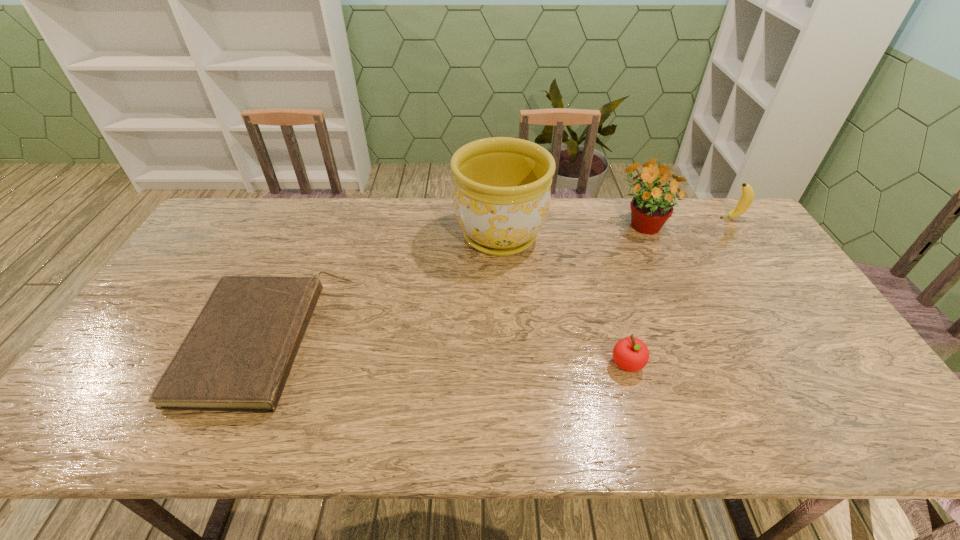
In order to click on free point between the leftmost object and the fourth object from left to right in this screenshot , I will do `click(455, 283)`.

The image size is (960, 540). What are the coordinates of `unoccupied position between the third object from left to right and the banana` in the screenshot? It's located at (679, 291).

This screenshot has height=540, width=960. I want to click on free space between the apple and the banana, so click(679, 291).

The width and height of the screenshot is (960, 540). What are the coordinates of `empty location between the apple and the right flowerpot` in the screenshot? It's located at (635, 294).

Image resolution: width=960 pixels, height=540 pixels. I want to click on free space between the apple and the shortest object, so click(447, 353).

The height and width of the screenshot is (540, 960). Find the location of `blank region between the rightmost object and the fourth object from right to left`. blank region between the rightmost object and the fourth object from right to left is located at coordinates (615, 227).

Identify which object is located as the fourth nearest to the banana. Please provide its 2D coordinates. Your answer should be formatted as a tuple, i.e. [(x, y)], where the tuple contains the x and y coordinates of a point satisfying the conditions above.

[(237, 356)]

Locate which object ranks fourth in proximity to the third object from right to left. Please provide its 2D coordinates. Your answer should be formatted as a tuple, i.e. [(x, y)], where the tuple contains the x and y coordinates of a point satisfying the conditions above.

[(746, 199)]

Identify the location of blank area in the image that satisfies the following two spatial constraints: 1. on the back side of the second shortest object; 2. on the spine side of the shortest object. This screenshot has width=960, height=540. click(x=620, y=343).

The width and height of the screenshot is (960, 540). I want to click on vacant space that satisfies the following two spatial constraints: 1. from the stem of the third shortest object; 2. on the front side of the left flowerpot, so click(x=744, y=236).